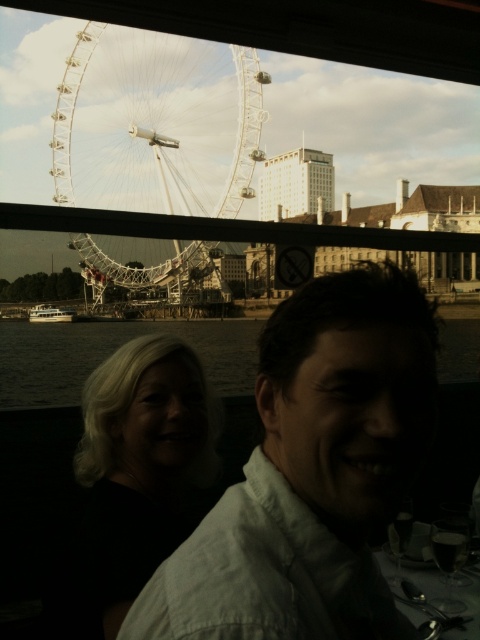
Question: Among these points, which one is farthest from the camera?

Choices:
 (A) (51, 358)
 (B) (68, 604)
 (C) (39, 316)
 (D) (189, 557)

Answer: (C)

Question: Which object is closer to the camera taking this photo?

Choices:
 (A) white glossy boat at lower left
 (B) white matte shirt at center
 (C) white metallic ferris wheel at upper left
 (D) dark hair at lower left

Answer: (B)

Question: Which point is closer to the camera taking this photo?

Choices:
 (A) (46, 308)
 (B) (400, 378)
 (C) (240, 81)

Answer: (B)

Question: Does white metallic ferris wheel at upper left have a lesser width compared to white glossy boat at lower left?

Choices:
 (A) yes
 (B) no

Answer: (B)

Question: Can you confirm if white matte shirt at center is wider than dark hair at lower left?

Choices:
 (A) yes
 (B) no

Answer: (A)

Question: Does white metallic ferris wheel at upper left have a greater width compared to dark hair at lower left?

Choices:
 (A) yes
 (B) no

Answer: (A)